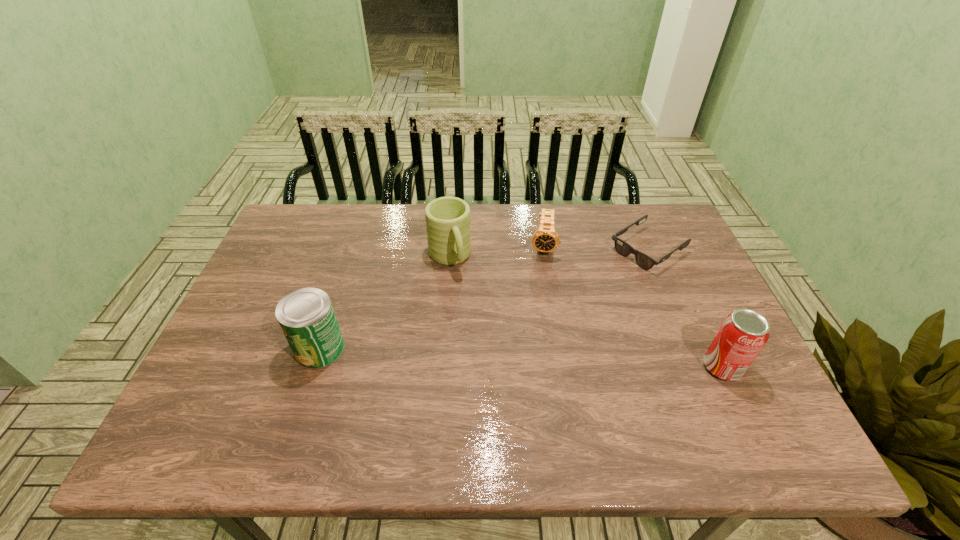
Locate an element on the screen. This screenshot has width=960, height=540. free space between the third object from right to left and the can is located at coordinates (431, 297).

Find the location of a particular element. This screenshot has width=960, height=540. object that is the third closest to the shortest object is located at coordinates (447, 219).

Point out which object is positioned as the fourth nearest to the fourth object from right to left. Please provide its 2D coordinates. Your answer should be formatted as a tuple, i.e. [(x, y)], where the tuple contains the x and y coordinates of a point satisfying the conditions above.

[(742, 335)]

Locate an element on the screen. This screenshot has width=960, height=540. vacant space that satisfies the following two spatial constraints: 1. on the back side of the shortest object; 2. on the right side of the second object from left to right is located at coordinates (450, 249).

Where is `vacant space that satisfies the following two spatial constraints: 1. on the front side of the third object from left to right; 2. on the left side of the shortest object`? The image size is (960, 540). vacant space that satisfies the following two spatial constraints: 1. on the front side of the third object from left to right; 2. on the left side of the shortest object is located at coordinates (543, 249).

The image size is (960, 540). In order to click on vacant space that satisfies the following two spatial constraints: 1. on the back side of the leftmost object; 2. on the right side of the sunglasses in this screenshot , I will do `click(351, 249)`.

Where is `free space that satisfies the following two spatial constraints: 1. on the front side of the soda can; 2. on the right side of the fourth tallest object`? This screenshot has height=540, width=960. free space that satisfies the following two spatial constraints: 1. on the front side of the soda can; 2. on the right side of the fourth tallest object is located at coordinates (562, 367).